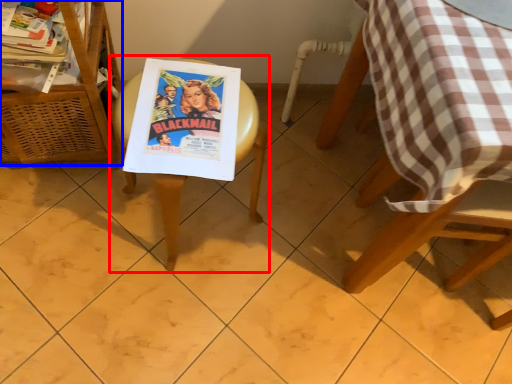
Question: Which object appears closest to the camera in this image, picnic table (highlighted by a red box) or furniture (highlighted by a blue box)?

Choices:
 (A) picnic table
 (B) furniture

Answer: (B)